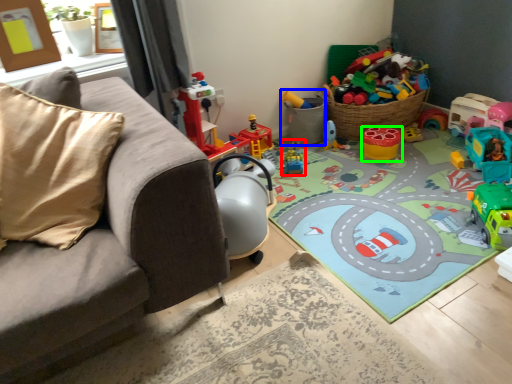
Question: Estimate the real-world distances between objects in this image. Which object is farther from toy (highlighted by a red box), toy (highlighted by a blue box) or toy (highlighted by a green box)?

Choices:
 (A) toy
 (B) toy

Answer: (B)